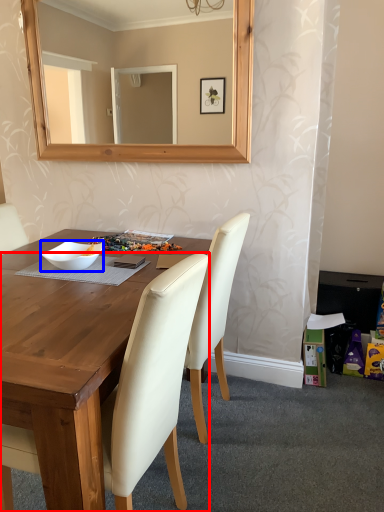
Question: Which point is closer to the camera, chair (highlighted by a red box) or bowl (highlighted by a blue box)?

Choices:
 (A) chair
 (B) bowl

Answer: (A)